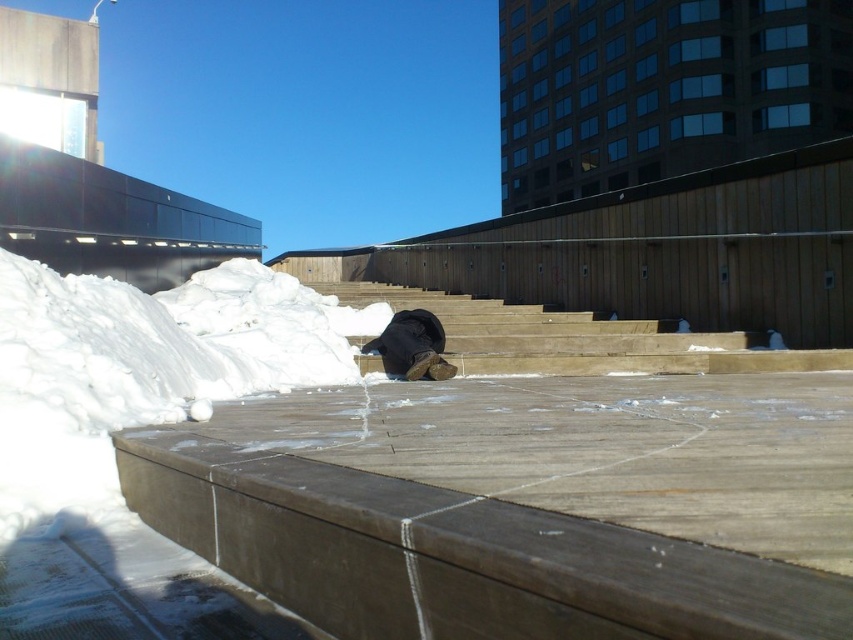
Is wooden at center to the right of matte black hat at center from the viewer's perspective?

Indeed, wooden at center is positioned on the right side of matte black hat at center.

Is point (630, 344) farther from viewer compared to point (440, 364)?

Yes, it is behind point (440, 364).

The width and height of the screenshot is (853, 640). I want to click on wooden at center, so click(561, 337).

Does white fluffy snow at lower left lie in front of matte black hat at center?

Yes.

Which is in front, point (215, 397) or point (419, 324)?

Point (215, 397) is in front.

Is point (329, 339) positioned after point (407, 342)?

Yes, point (329, 339) is farther from viewer.

Locate an element on the screen. Image resolution: width=853 pixels, height=640 pixels. white fluffy snow at lower left is located at coordinates (141, 369).

Between white fluffy snow at lower left and wooden at center, which one has more height?

white fluffy snow at lower left is taller.

Which is above, white fluffy snow at lower left or wooden at center?

wooden at center is above.

Is point (225, 353) more distant than point (631, 328)?

No, (225, 353) is closer to viewer.

This screenshot has height=640, width=853. I want to click on white fluffy snow at lower left, so click(141, 369).